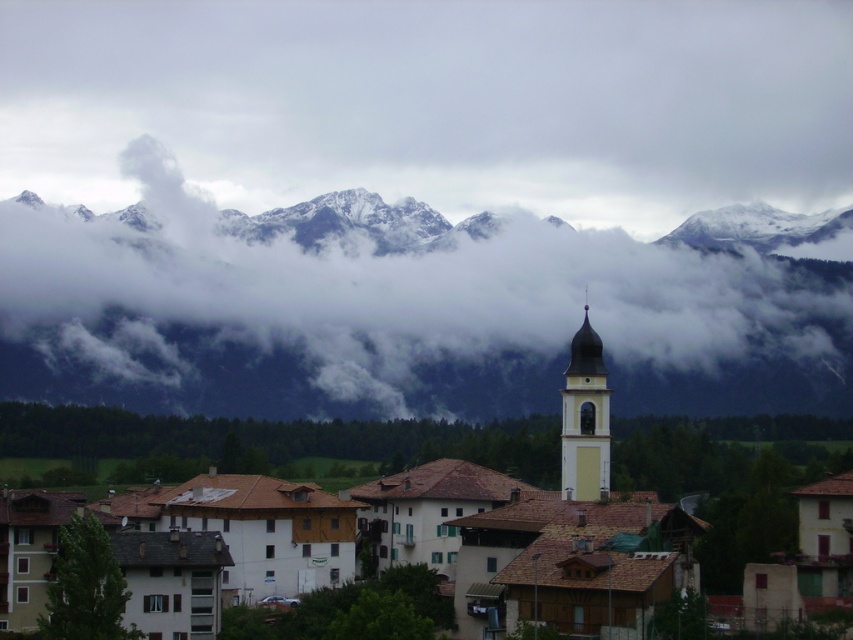
Between matte brown building at center and smooth cream steeple at center-right, which one appears on the right side from the viewer's perspective?

matte brown building at center

Is point (462, 426) behind point (593, 404)?

Yes, it is.

The width and height of the screenshot is (853, 640). Find the location of `matte brown building at center`. matte brown building at center is located at coordinates (268, 442).

Image resolution: width=853 pixels, height=640 pixels. Find the location of `matte brown building at center`. matte brown building at center is located at coordinates (268, 442).

Between snowy rock mountain range at upper center and smooth cream steeple at center-right, which one has more height?

With more height is snowy rock mountain range at upper center.

Does snowy rock mountain range at upper center have a greater width compared to smooth cream steeple at center-right?

Yes, snowy rock mountain range at upper center is wider than smooth cream steeple at center-right.

Does point (741, 323) lie in front of point (572, 369)?

No, it is not.

Where is `snowy rock mountain range at upper center`? The height and width of the screenshot is (640, 853). snowy rock mountain range at upper center is located at coordinates [413, 310].

Can you confirm if snowy rock mountain range at upper center is positioned to the right of matte brown building at center?

Incorrect, snowy rock mountain range at upper center is not on the right side of matte brown building at center.

Describe the element at coordinates (413, 310) in the screenshot. The height and width of the screenshot is (640, 853). I see `snowy rock mountain range at upper center` at that location.

Is point (439, 285) behind point (125, 452)?

Yes, point (439, 285) is behind point (125, 452).

Find the location of a particular element. snowy rock mountain range at upper center is located at coordinates (413, 310).